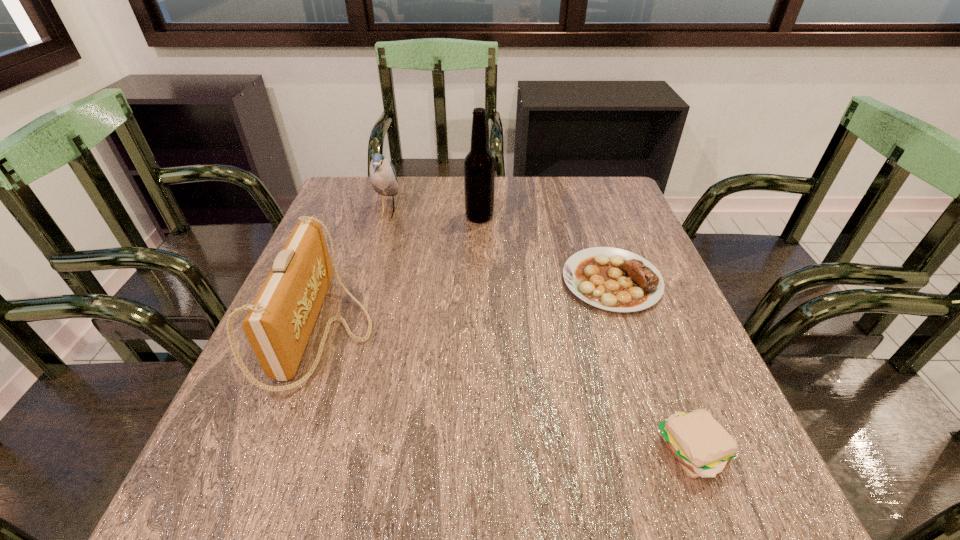
Where is `free space that satisfies the following two spatial constraints: 1. at the tip of the bird's beak; 2. on the right side of the second shortest object`? Image resolution: width=960 pixels, height=540 pixels. free space that satisfies the following two spatial constraints: 1. at the tip of the bird's beak; 2. on the right side of the second shortest object is located at coordinates (319, 452).

The height and width of the screenshot is (540, 960). In order to click on vacant space that satisfies the following two spatial constraints: 1. at the tip of the bird's beak; 2. on the left side of the fourth tallest object in this screenshot , I will do `click(319, 452)`.

At what (x,y) coordinates should I click in order to perform the action: click on vacant region that satisfies the following two spatial constraints: 1. at the tip of the tallest object's beak; 2. on the right side of the bird. Please return your answer as a coordinate pair (x, y). The width and height of the screenshot is (960, 540). Looking at the image, I should click on (387, 217).

The width and height of the screenshot is (960, 540). In order to click on vacant region that satisfies the following two spatial constraints: 1. on the front side of the second shortest object; 2. on the right side of the shortest object in this screenshot , I will do `click(670, 452)`.

This screenshot has height=540, width=960. What are the coordinates of `vacant space that satisfies the following two spatial constraints: 1. at the tip of the bird's beak; 2. on the left side of the patty` in the screenshot? It's located at [x=319, y=452].

Find the location of a particular element. The image size is (960, 540). blank space that satisfies the following two spatial constraints: 1. at the tip of the nearest object's beak; 2. on the left side of the bird is located at coordinates (319, 452).

Locate an element on the screen. free space in the image that satisfies the following two spatial constraints: 1. on the back side of the third object from right to left; 2. at the tip of the bird's beak is located at coordinates (479, 212).

Where is `vacant space that satisfies the following two spatial constraints: 1. at the tip of the shortest object's beak; 2. on the right side of the bird`? This screenshot has height=540, width=960. vacant space that satisfies the following two spatial constraints: 1. at the tip of the shortest object's beak; 2. on the right side of the bird is located at coordinates (369, 281).

The width and height of the screenshot is (960, 540). I want to click on blank space that satisfies the following two spatial constraints: 1. at the tip of the patty's beak; 2. on the left side of the bird, so coord(319,452).